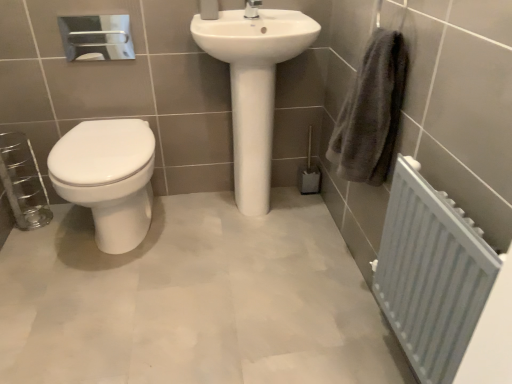
Question: Should I look upward or downward to see white glossy sink at center?

Choices:
 (A) up
 (B) down

Answer: (A)

Question: Can you confirm if white glossy toilet at left is taller than white painted metal radiator at lower right?

Choices:
 (A) yes
 (B) no

Answer: (B)

Question: Is white glossy toilet at left bigger than white painted metal radiator at lower right?

Choices:
 (A) yes
 (B) no

Answer: (A)

Question: Is white glossy toilet at left outside of white painted metal radiator at lower right?

Choices:
 (A) yes
 (B) no

Answer: (A)

Question: From the image's perspective, would you say white glossy toilet at left is positioned over white painted metal radiator at lower right?

Choices:
 (A) yes
 (B) no

Answer: (A)

Question: From the image's perspective, is white glossy toilet at left beneath white painted metal radiator at lower right?

Choices:
 (A) yes
 (B) no

Answer: (B)

Question: From a real-world perspective, is white glossy toilet at left under white painted metal radiator at lower right?

Choices:
 (A) yes
 (B) no

Answer: (A)

Question: Is white glossy sink at center positioned with its back to white painted metal radiator at lower right?

Choices:
 (A) yes
 (B) no

Answer: (B)

Question: Can you confirm if white glossy sink at center is taller than white painted metal radiator at lower right?

Choices:
 (A) yes
 (B) no

Answer: (A)

Question: From the image's perspective, would you say white glossy sink at center is positioned over white painted metal radiator at lower right?

Choices:
 (A) yes
 (B) no

Answer: (A)

Question: Does white glossy sink at center appear on the left side of white painted metal radiator at lower right?

Choices:
 (A) no
 (B) yes

Answer: (B)

Question: Is white glossy sink at center not within white painted metal radiator at lower right?

Choices:
 (A) no
 (B) yes

Answer: (B)

Question: Could you tell me if white glossy sink at center is turned towards white painted metal radiator at lower right?

Choices:
 (A) no
 (B) yes

Answer: (B)

Question: Is white glossy sink at center thinner than white glossy toilet at left?

Choices:
 (A) no
 (B) yes

Answer: (B)